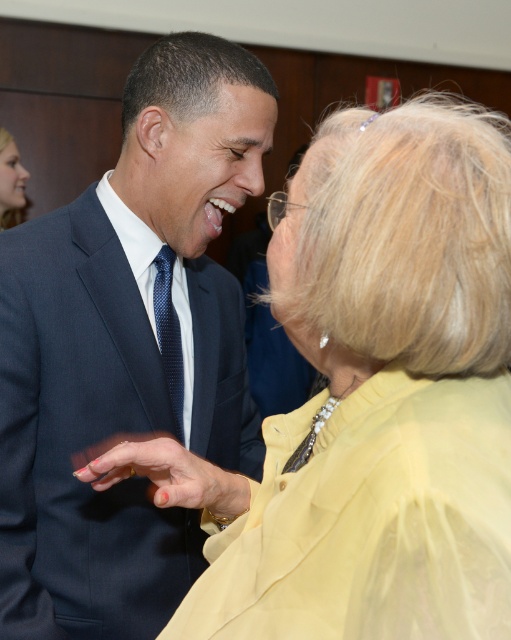
Question: Can you confirm if yellow satin blouse at center is wider than blue dotted tie at center?

Choices:
 (A) yes
 (B) no

Answer: (A)

Question: Can you confirm if yellow satin blouse at center is positioned to the right of blue dotted tie at center?

Choices:
 (A) yes
 (B) no

Answer: (A)

Question: Does matte black suit at center appear over blue dotted tie at center?

Choices:
 (A) no
 (B) yes

Answer: (B)

Question: Estimate the real-world distances between objects in this image. Which object is closer to the matte black suit at center?

Choices:
 (A) yellow satin blouse at center
 (B) blue dotted tie at center

Answer: (B)

Question: Based on their relative distances, which object is farther from the yellow satin blouse at center?

Choices:
 (A) blue dotted tie at center
 (B) matte black suit at center

Answer: (A)

Question: Among these objects, which one is farthest from the camera?

Choices:
 (A) matte black suit at center
 (B) blue dotted tie at center
 (C) yellow satin blouse at center

Answer: (B)